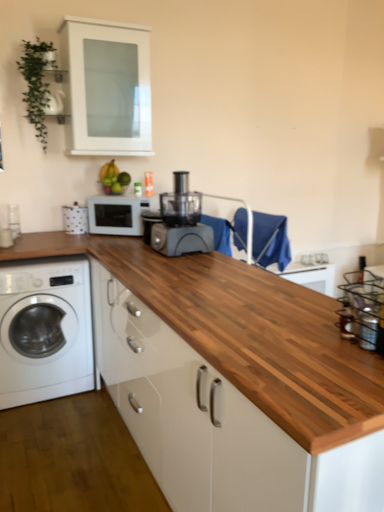
Question: Considering the relative sizes of white matte cabinet at upper center and wooden at center in the image provided, is white matte cabinet at upper center shorter than wooden at center?

Choices:
 (A) no
 (B) yes

Answer: (B)

Question: Does white matte cabinet at upper center have a greater height compared to wooden at center?

Choices:
 (A) no
 (B) yes

Answer: (A)

Question: Is white matte cabinet at upper center positioned beyond the bounds of wooden at center?

Choices:
 (A) no
 (B) yes

Answer: (B)

Question: Is white matte cabinet at upper center far away from wooden at center?

Choices:
 (A) no
 (B) yes

Answer: (B)

Question: From a real-world perspective, is white matte cabinet at upper center below wooden at center?

Choices:
 (A) yes
 (B) no

Answer: (B)

Question: From the image's perspective, is clear glass bottle at right located above or below white matte microwave at center?

Choices:
 (A) above
 (B) below

Answer: (B)

Question: From a real-world perspective, is clear glass bottle at right above or below white matte microwave at center?

Choices:
 (A) below
 (B) above

Answer: (A)

Question: Is clear glass bottle at right in front of or behind white matte microwave at center in the image?

Choices:
 (A) behind
 (B) front

Answer: (B)

Question: Is point 345,331 closer or farther from the camera than point 132,225?

Choices:
 (A) closer
 (B) farther

Answer: (A)

Question: From a real-world perspective, is white matte cabinet at upper center physically located above or below wooden at center?

Choices:
 (A) below
 (B) above

Answer: (B)

Question: Considering their positions, is white matte cabinet at upper center located in front of or behind wooden at center?

Choices:
 (A) behind
 (B) front

Answer: (A)

Question: In terms of width, does white matte cabinet at upper center look wider or thinner when compared to wooden at center?

Choices:
 (A) thin
 (B) wide

Answer: (A)

Question: In the image, is white matte cabinet at upper center on the left side or the right side of wooden at center?

Choices:
 (A) right
 (B) left

Answer: (B)

Question: In the image, is matte black food processor at center on the left side or the right side of wooden at center?

Choices:
 (A) right
 (B) left

Answer: (A)

Question: Is matte black food processor at center inside the boundaries of wooden at center, or outside?

Choices:
 (A) outside
 (B) inside

Answer: (A)